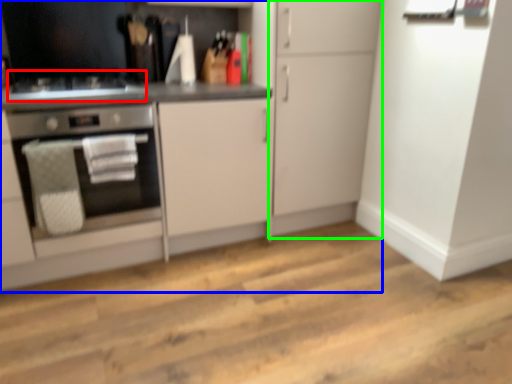
Question: Based on their relative distances, which object is nearer to gas stove (highlighted by a red box)? Choose from cabinetry (highlighted by a blue box) and cabinetry (highlighted by a green box).

Choices:
 (A) cabinetry
 (B) cabinetry

Answer: (A)